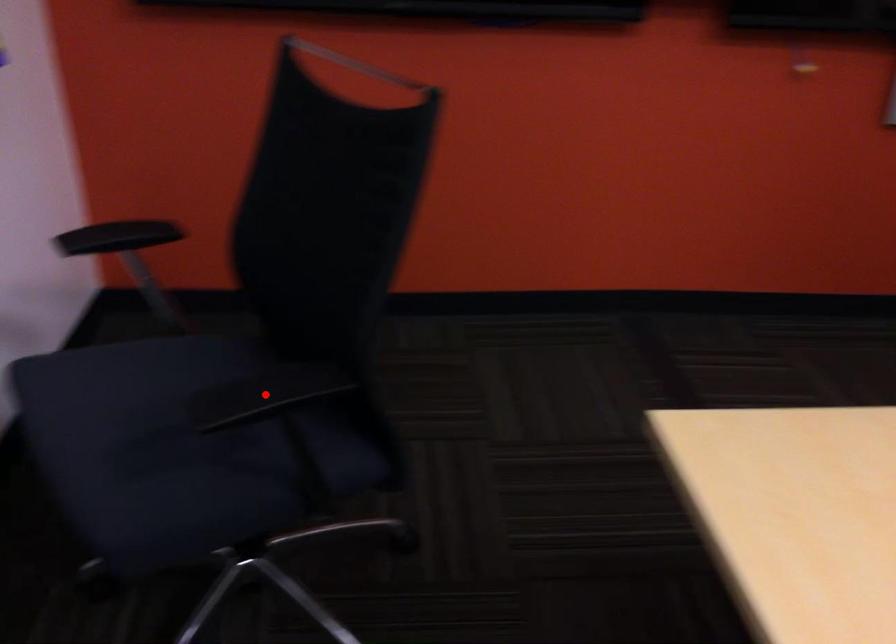
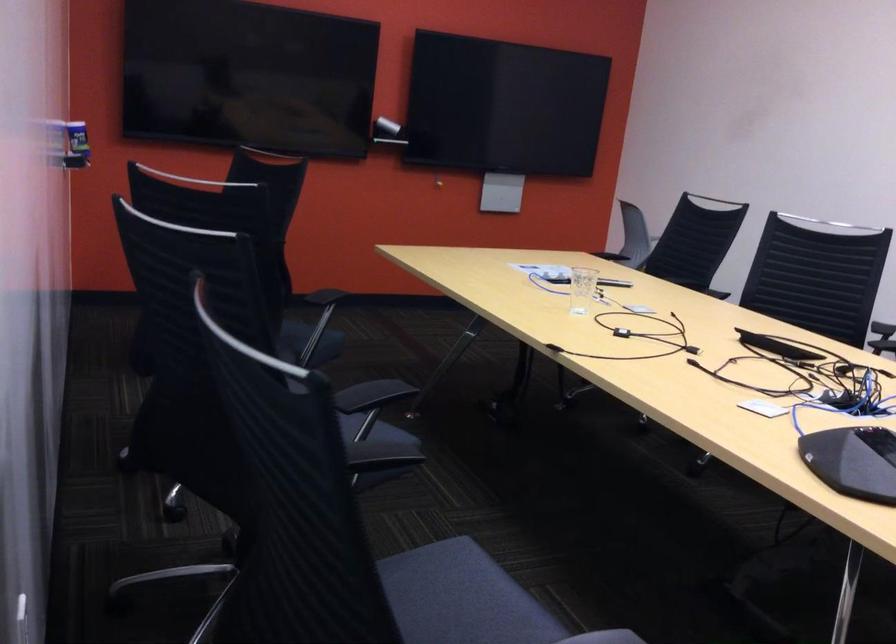
Question: I am providing you with two images of the same scene from different viewpoints. A red point is marked on the first image. Is the red point's position out of view in image 2?

Choices:
 (A) Yes
 (B) No

Answer: (A)